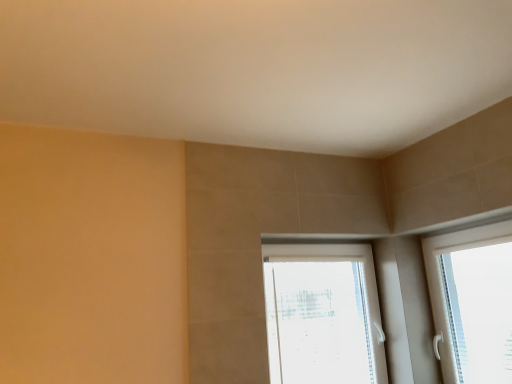
Describe the element at coordinates (472, 302) in the screenshot. The width and height of the screenshot is (512, 384). I see `white plastic window at right` at that location.

At what (x,y) coordinates should I click in order to perform the action: click on white plastic window at right. Please return your answer as a coordinate pair (x, y). The height and width of the screenshot is (384, 512). Looking at the image, I should click on (472, 302).

This screenshot has width=512, height=384. I want to click on white plastic window at right, so click(472, 302).